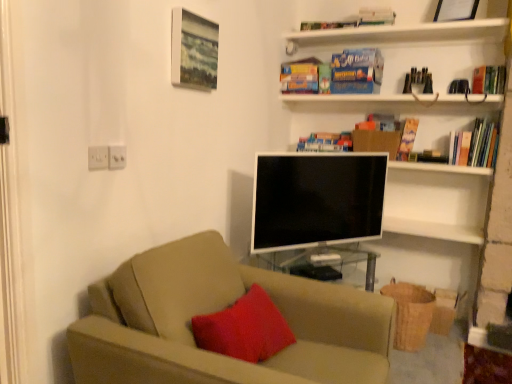
Question: From the image's perspective, relative to hardcover book at upper right, arranged as the first paperback book when viewed from the right, is beige fabric couch at center above or below?

Choices:
 (A) above
 (B) below

Answer: (B)

Question: Is point (164, 339) closer or farther from the camera than point (412, 135)?

Choices:
 (A) farther
 (B) closer

Answer: (B)

Question: Estimate the real-world distances between objects in this image. Which object is closer to the blue matte bookshelf at upper center, positioned as the 1th book in bottom-to-top order?

Choices:
 (A) hardcover book at upper center, the first paperback book in the left-to-right sequence
 (B) wooden textured picture frame at upper center, positioned as the 1th picture frame in left-to-right order
 (C) velvety red pillow at center
 (D) hardcover book at upper right, marked as the 3th book in a top-to-bottom arrangement
 (E) white glossy flat-screen tv at center

Answer: (A)

Question: Which is nearer to the beige fabric couch at center?

Choices:
 (A) white glossy flat-screen tv at center
 (B) hardcover book at upper center, marked as the 2th book in a top-to-bottom arrangement
 (C) hardcover book at upper right, arranged as the first paperback book when viewed from the right
 (D) wooden picture frame at upper right, the 2th picture frame positioned from the bottom
 (E) hardcover book at upper right, the 2th book from the bottom

Answer: (A)